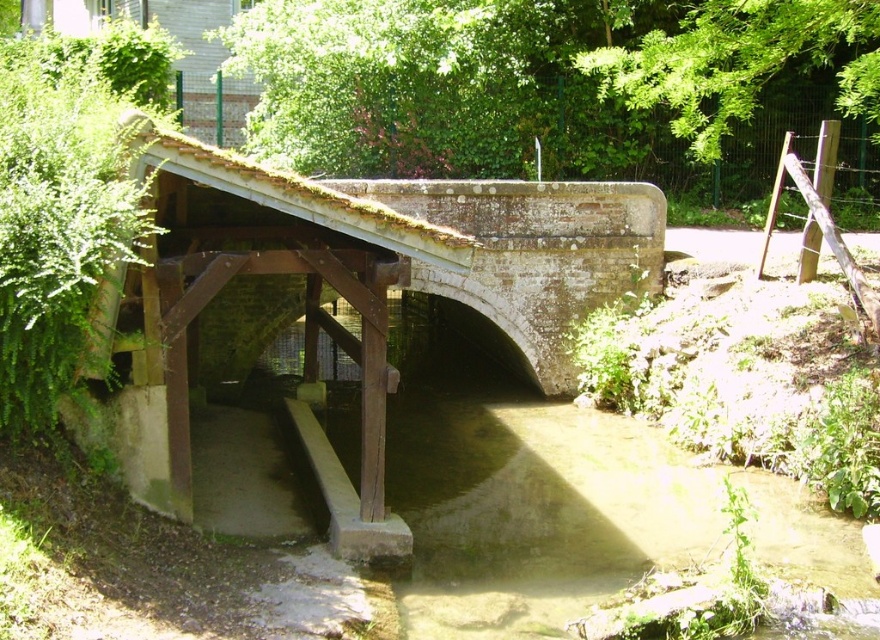
Question: Can you confirm if white stone bridge at center is positioned to the right of brown concrete water at center?

Choices:
 (A) no
 (B) yes

Answer: (A)

Question: Is white stone bridge at center positioned at the back of brown concrete water at center?

Choices:
 (A) no
 (B) yes

Answer: (A)

Question: Which of the following is the closest to the observer?

Choices:
 (A) brown concrete water at center
 (B) white stone bridge at center

Answer: (B)

Question: Which point is farther to the camera?

Choices:
 (A) white stone bridge at center
 (B) brown concrete water at center

Answer: (B)

Question: Which point is farther from the camera taking this photo?

Choices:
 (A) (776, 483)
 (B) (550, 253)

Answer: (B)

Question: Is white stone bridge at center smaller than brown concrete water at center?

Choices:
 (A) no
 (B) yes

Answer: (A)